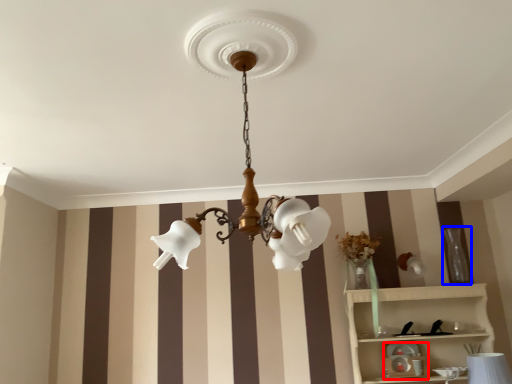
Question: Among these objects, which one is nearest to the camera, toy (highlighted by a red box) or vase (highlighted by a blue box)?

Choices:
 (A) toy
 (B) vase

Answer: (A)